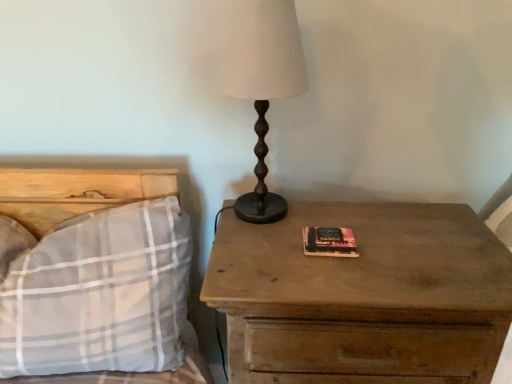
Question: Would you consider wooden nightstand at right to be distant from plaid fabric pillow at left?

Choices:
 (A) yes
 (B) no

Answer: (B)

Question: Can you confirm if wooden nightstand at right is positioned to the right of plaid fabric pillow at left?

Choices:
 (A) no
 (B) yes

Answer: (B)

Question: Is wooden nightstand at right thinner than plaid fabric pillow at left?

Choices:
 (A) no
 (B) yes

Answer: (A)

Question: From the image's perspective, is wooden nightstand at right located beneath plaid fabric pillow at left?

Choices:
 (A) no
 (B) yes

Answer: (B)

Question: Is the position of wooden nightstand at right less distant than that of plaid fabric pillow at left?

Choices:
 (A) yes
 (B) no

Answer: (A)

Question: Could you tell me if wooden nightstand at right is facing plaid fabric pillow at left?

Choices:
 (A) no
 (B) yes

Answer: (A)

Question: From the image's perspective, is matte brown table lamp at center on plaid fabric pillow at left?

Choices:
 (A) yes
 (B) no

Answer: (A)

Question: Is matte brown table lamp at center oriented towards plaid fabric pillow at left?

Choices:
 (A) yes
 (B) no

Answer: (B)

Question: Does matte brown table lamp at center have a lesser height compared to plaid fabric pillow at left?

Choices:
 (A) yes
 (B) no

Answer: (B)

Question: Does matte brown table lamp at center have a smaller size compared to plaid fabric pillow at left?

Choices:
 (A) yes
 (B) no

Answer: (A)

Question: Considering the relative positions of matte brown table lamp at center and plaid fabric pillow at left in the image provided, is matte brown table lamp at center to the right of plaid fabric pillow at left from the viewer's perspective?

Choices:
 (A) yes
 (B) no

Answer: (A)

Question: Is matte brown table lamp at center located outside plaid fabric pillow at left?

Choices:
 (A) yes
 (B) no

Answer: (A)

Question: Considering the relative sizes of plaid fabric pillow at left and matte brown table lamp at center in the image provided, is plaid fabric pillow at left smaller than matte brown table lamp at center?

Choices:
 (A) yes
 (B) no

Answer: (B)